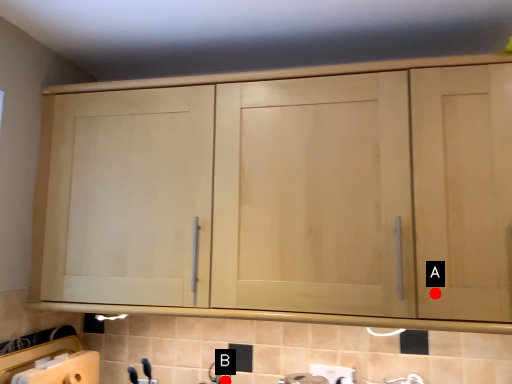
Question: Two points are circled on the image, labeled by A and B beside each circle. Which point is farther to the camera?

Choices:
 (A) A is further
 (B) B is further

Answer: (B)